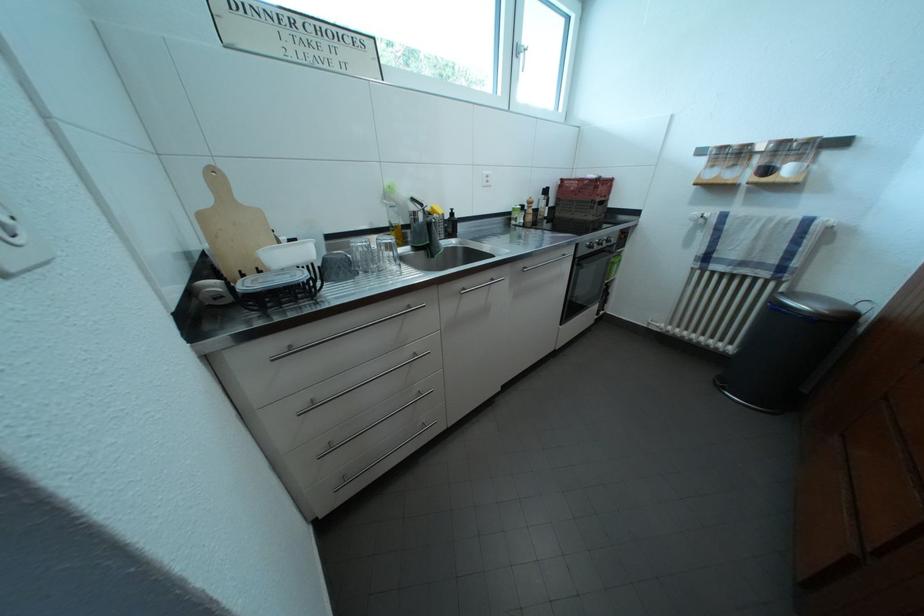
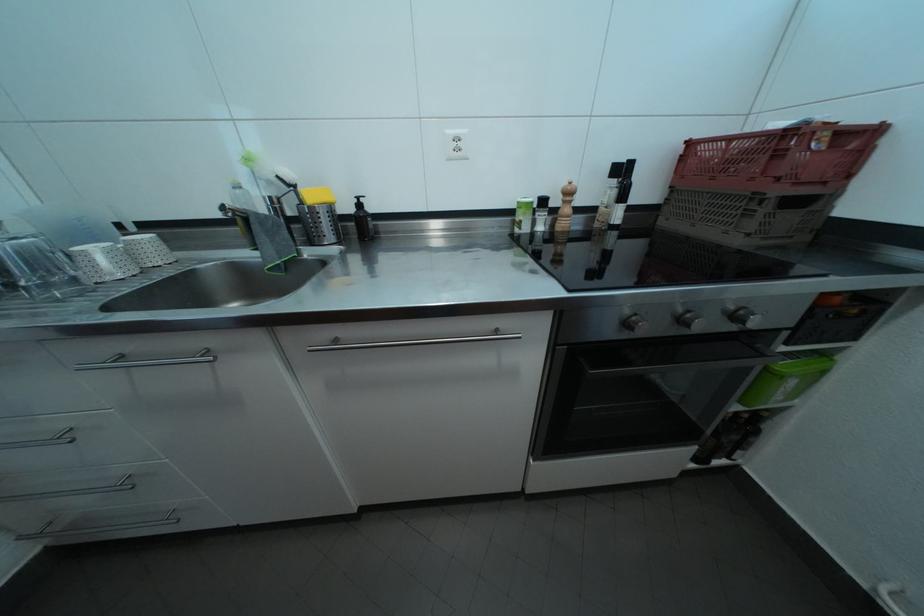
Locate, in the second image, the point that corresponds to point (600, 253) in the first image.

(638, 330)